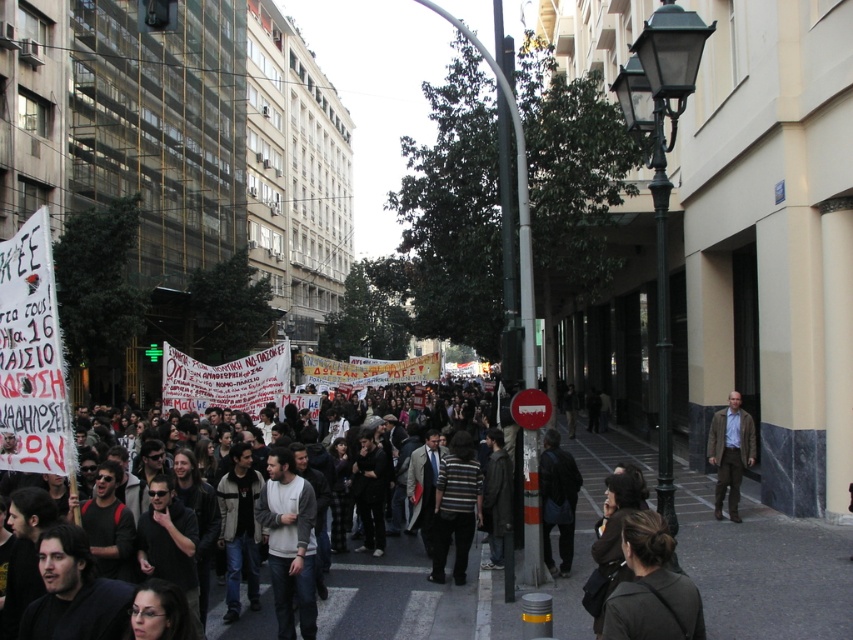
Question: Does dark gray clothing at center have a lesser width compared to brown leather jacket at right?

Choices:
 (A) yes
 (B) no

Answer: (B)

Question: Does dark gray clothing at center appear over brown leather jacket at right?

Choices:
 (A) no
 (B) yes

Answer: (A)

Question: Which point is farther from the camera taking this photo?

Choices:
 (A) (282, 612)
 (B) (482, 426)

Answer: (B)

Question: Which of the following is the farthest from the observer?

Choices:
 (A) (457, 634)
 (B) (299, 566)

Answer: (A)

Question: Which object is the closest to the dark gray clothing at center?

Choices:
 (A) gray cotton shirt at center
 (B) brown leather jacket at right

Answer: (A)

Question: Can you confirm if gray cotton shirt at center is positioned above brown leather jacket at right?

Choices:
 (A) yes
 (B) no

Answer: (B)